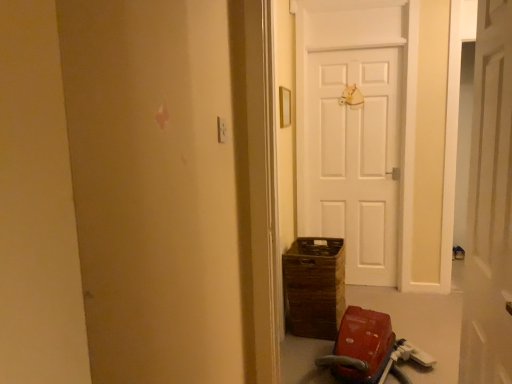
Question: Considering the relative sizes of red plastic baby carriage at lower right and white matte door at center in the image provided, is red plastic baby carriage at lower right bigger than white matte door at center?

Choices:
 (A) yes
 (B) no

Answer: (A)

Question: From a real-world perspective, is red plastic baby carriage at lower right physically above white matte door at center?

Choices:
 (A) no
 (B) yes

Answer: (A)

Question: Considering the relative positions of red plastic baby carriage at lower right and white matte door at center in the image provided, is red plastic baby carriage at lower right in front of white matte door at center?

Choices:
 (A) no
 (B) yes

Answer: (A)

Question: Can you confirm if red plastic baby carriage at lower right is smaller than white matte door at center?

Choices:
 (A) no
 (B) yes

Answer: (A)

Question: Are red plastic baby carriage at lower right and white matte door at center far apart?

Choices:
 (A) no
 (B) yes

Answer: (B)

Question: Does red plastic baby carriage at lower right have a greater width compared to white matte door at center?

Choices:
 (A) no
 (B) yes

Answer: (B)

Question: From a real-world perspective, does white matte door at center stand above red plastic baby carriage at lower right?

Choices:
 (A) yes
 (B) no

Answer: (A)

Question: Can you confirm if white matte door at center is positioned to the left of red plastic baby carriage at lower right?

Choices:
 (A) no
 (B) yes

Answer: (A)

Question: Is red plastic baby carriage at lower right located within white matte door at center?

Choices:
 (A) yes
 (B) no

Answer: (B)

Question: Is white matte door at center aimed at red plastic baby carriage at lower right?

Choices:
 (A) yes
 (B) no

Answer: (B)

Question: Can you confirm if white matte door at center is wider than red plastic baby carriage at lower right?

Choices:
 (A) no
 (B) yes

Answer: (A)

Question: Does white matte door at center come in front of red plastic baby carriage at lower right?

Choices:
 (A) no
 (B) yes

Answer: (B)

Question: Choose the correct answer: Is white matte door at center inside red plastic baby carriage at lower right or outside it?

Choices:
 (A) inside
 (B) outside

Answer: (B)